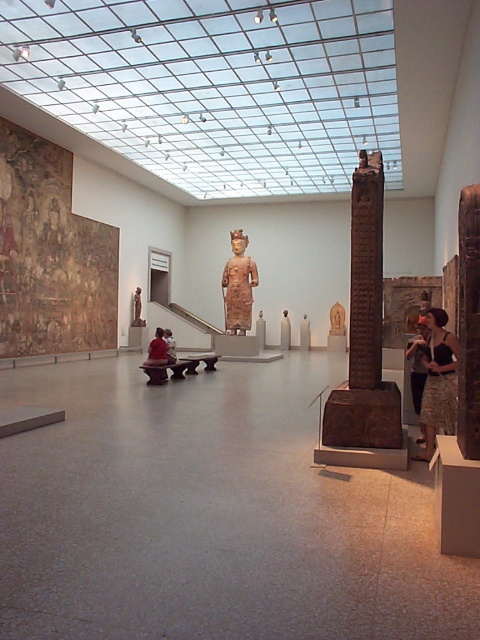
Question: Does black textured skirt at lower right appear under matte black statue at center?

Choices:
 (A) yes
 (B) no

Answer: (A)

Question: Estimate the real-world distances between objects in this image. Which object is farther from the black textured skirt at lower right?

Choices:
 (A) matte brown statue at center
 (B) matte black statue at center

Answer: (A)

Question: Does brown stone pillar at center have a larger size compared to matte brown statue at center?

Choices:
 (A) yes
 (B) no

Answer: (B)

Question: Which of these objects is positioned farthest from the brown stone pillar at center?

Choices:
 (A) black textured skirt at lower right
 (B) matte brown statue at center
 (C) matte black statue at center

Answer: (B)

Question: Based on their relative distances, which object is nearer to the black textured skirt at lower right?

Choices:
 (A) matte black statue at center
 (B) brown stone pillar at center
 (C) matte brown statue at center

Answer: (A)

Question: Can you confirm if brown stone pillar at center is bigger than matte brown statue at center?

Choices:
 (A) yes
 (B) no

Answer: (B)